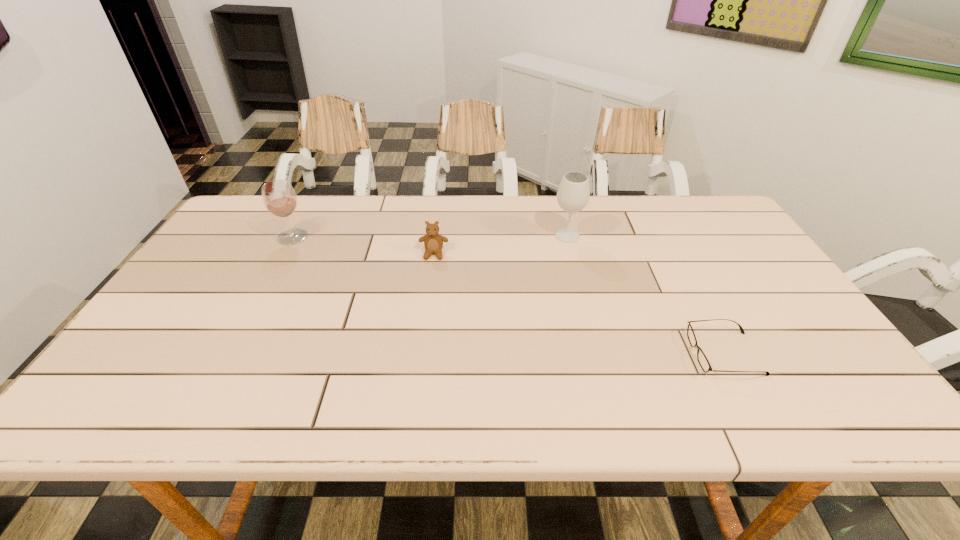
You are a GUI agent. You are given a task and a screenshot of the screen. Output one action in this format:
    pyautogui.click(x=<x>, y=<y>)
    Task: Click on the third object from left to right
    This screenshot has height=540, width=960.
    Given the screenshot: What is the action you would take?
    pyautogui.click(x=573, y=194)

The height and width of the screenshot is (540, 960). In order to click on the leftmost object in this screenshot , I will do `click(279, 197)`.

The width and height of the screenshot is (960, 540). What are the coordinates of `the second nearest object` in the screenshot? It's located at (433, 242).

Locate an element on the screen. This screenshot has width=960, height=540. teddy bear is located at coordinates (433, 242).

Locate an element on the screen. the nearest object is located at coordinates (702, 359).

This screenshot has height=540, width=960. I want to click on spectacles, so click(x=702, y=359).

At what (x,y) coordinates should I click in order to perform the action: click on free space located 0.340m on the front of the right wineglass. Please return your answer as a coordinate pair (x, y). Looking at the image, I should click on (590, 328).

Locate an element on the screen. This screenshot has height=540, width=960. free space located 0.130m on the front of the left wineglass is located at coordinates (273, 274).

Find the location of a particular element. free region located 0.310m on the front-facing side of the teddy bear is located at coordinates (422, 344).

This screenshot has width=960, height=540. What are the coordinates of `vacant area located 0.240m on the front-facing side of the nearest object` in the screenshot? It's located at (588, 354).